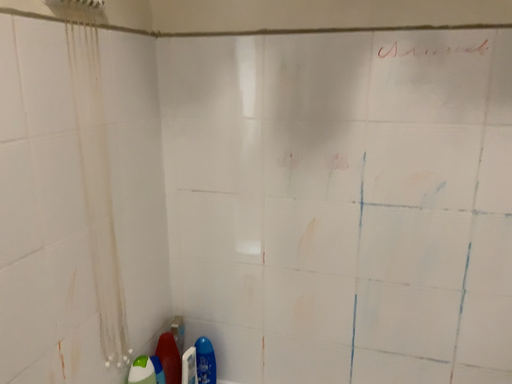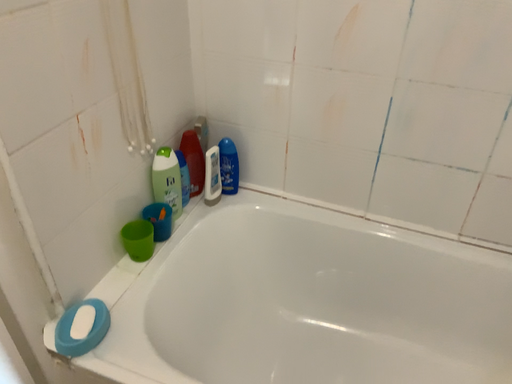
Question: How did the camera likely rotate when shooting the video?

Choices:
 (A) rotated downward
 (B) rotated upward

Answer: (A)